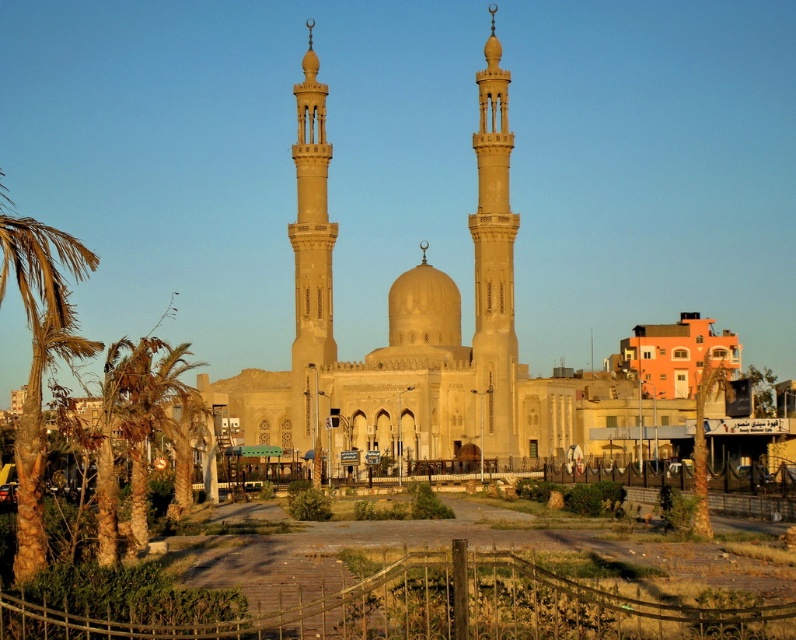
You are standing at the entrance of the mosque and want to take a photo of both the beige stone minaret at center and the brown textured palm tree at left. If your camera can capture objects within a 150 feet range, will both be in frame?

The beige stone minaret at center is 140.84 feet away from the brown textured palm tree at left. Since the distance between them is within the camera range of 150 feet, both objects will be in frame.

You are standing in front of the mosque and notice two palm trees on the left side. Which palm tree is closer to you, the brown textured palm tree at left or the green leafy palm tree at left?

The brown textured palm tree at left is closer because it is positioned over the green leafy palm tree at left, indicating it is in front.